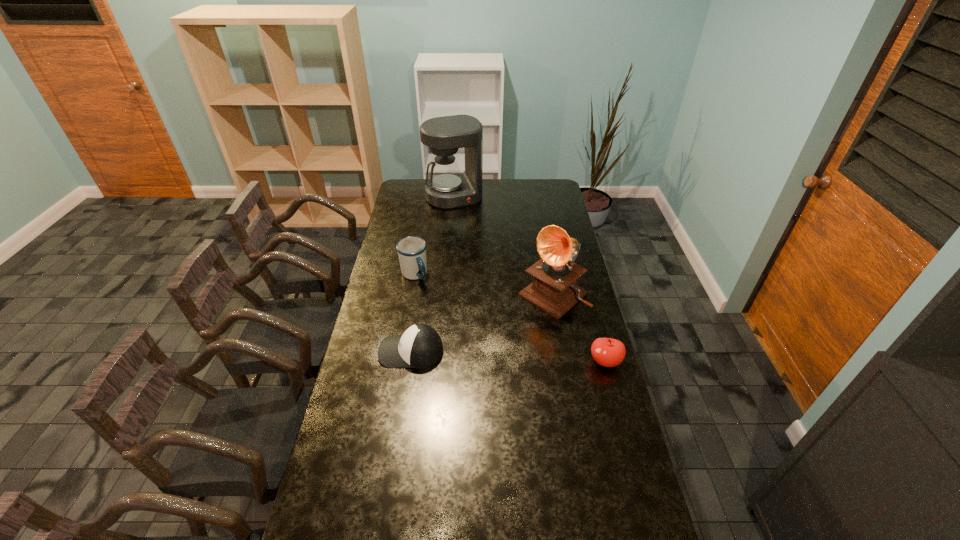
This screenshot has width=960, height=540. What are the coordinates of `phonograph record located at the right edge` in the screenshot? It's located at (554, 289).

Identify the location of object present at the far left corner. The image size is (960, 540). (448, 188).

In the image, there is a desktop. Identify the location of vacant space at the near edge. This screenshot has width=960, height=540. (526, 529).

Locate an element on the screen. This screenshot has height=540, width=960. vacant space at the left edge is located at coordinates (369, 342).

You are a GUI agent. You are given a task and a screenshot of the screen. Output one action in this format:
    pyautogui.click(x=<x>, y=<y>)
    Task: Click on the free location at the far left corner
    Image resolution: width=960 pixels, height=540 pixels.
    Given the screenshot: What is the action you would take?
    413,200

Locate an element on the screen. free space between the phonograph record and the cap is located at coordinates (482, 323).

This screenshot has width=960, height=540. In order to click on free spot between the third tallest object and the farthest object in this screenshot , I will do `click(434, 235)`.

This screenshot has height=540, width=960. Identify the location of empty space that is in between the coffee maker and the third tallest object. (434, 235).

Where is `vacant space that's between the third tallest object and the phonograph record`? The image size is (960, 540). vacant space that's between the third tallest object and the phonograph record is located at coordinates click(x=484, y=285).

Image resolution: width=960 pixels, height=540 pixels. Identify the location of free space that is in between the apple and the coffee maker. (530, 279).